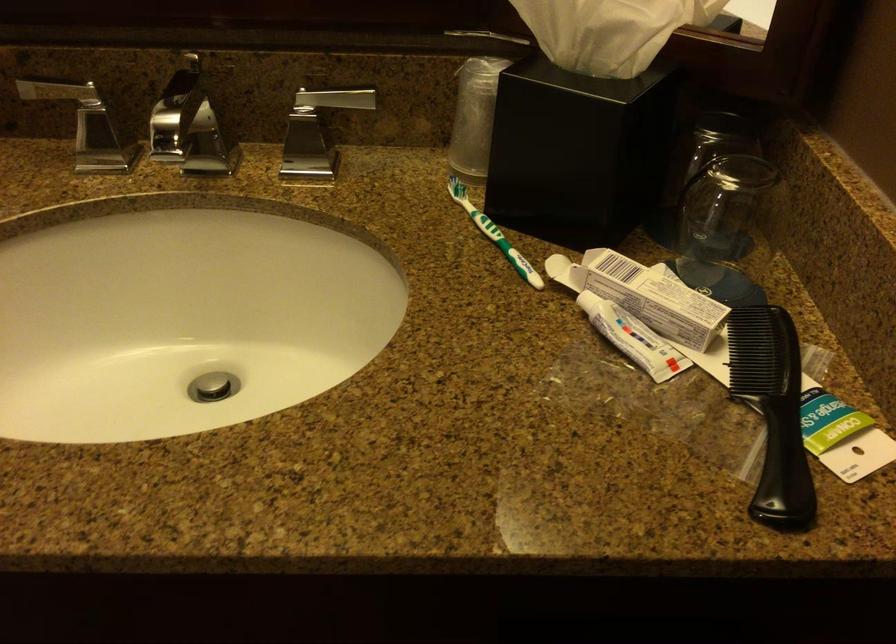
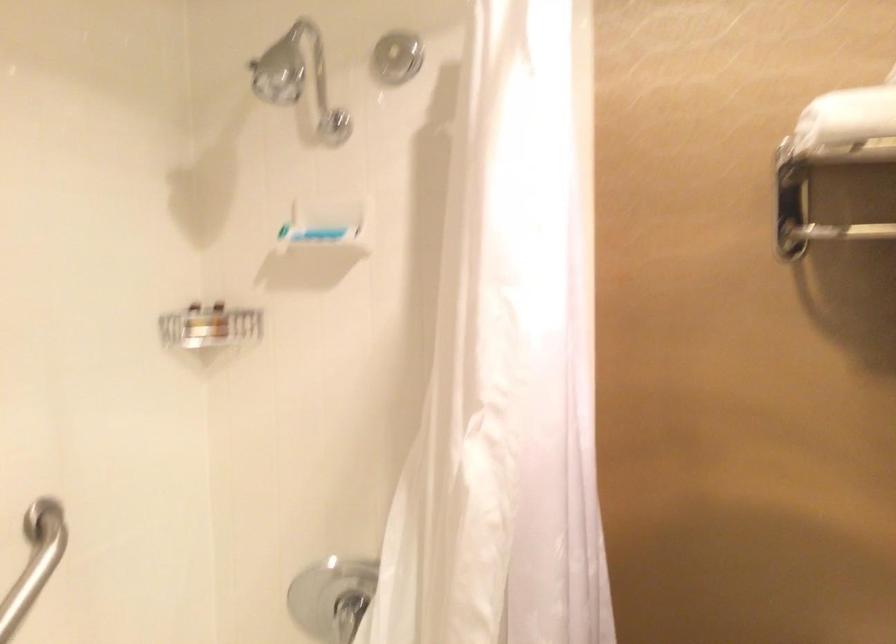
Question: The first image is from the beginning of the video and the second image is from the end. How did the camera likely rotate when shooting the video?

Choices:
 (A) Left
 (B) Right
 (C) Up
 (D) Down

Answer: (A)